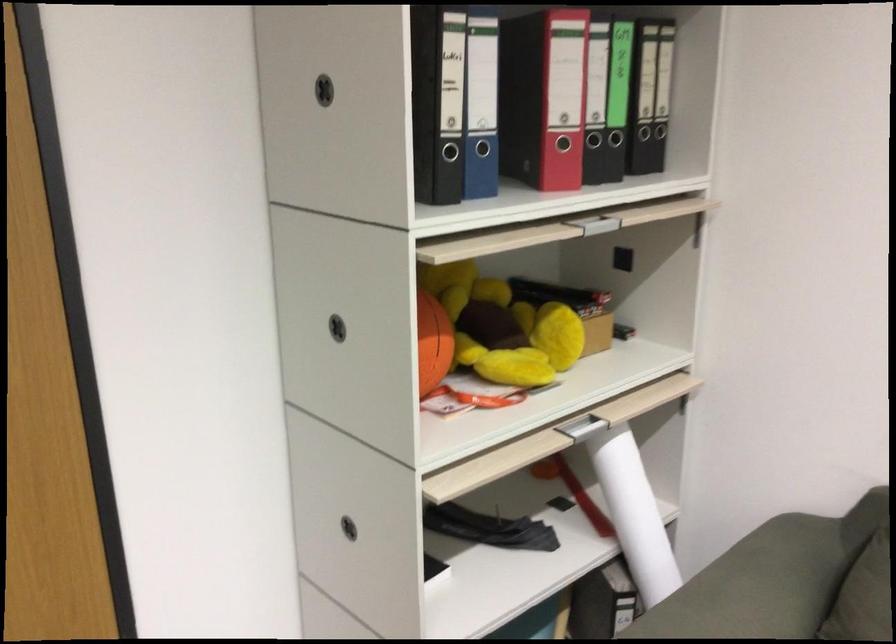
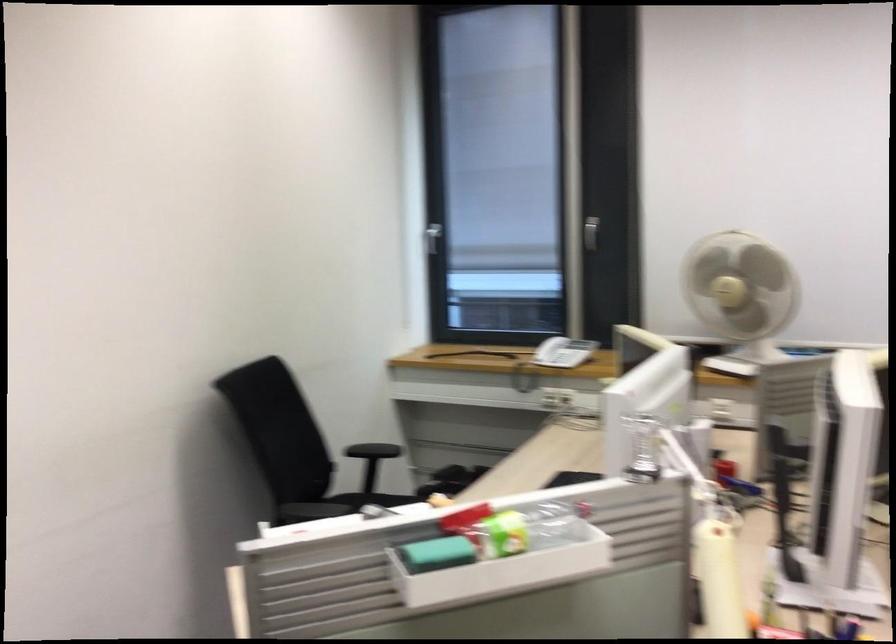
Question: How did the camera likely rotate?

Choices:
 (A) Left
 (B) Right
 (C) Up
 (D) Down

Answer: (B)